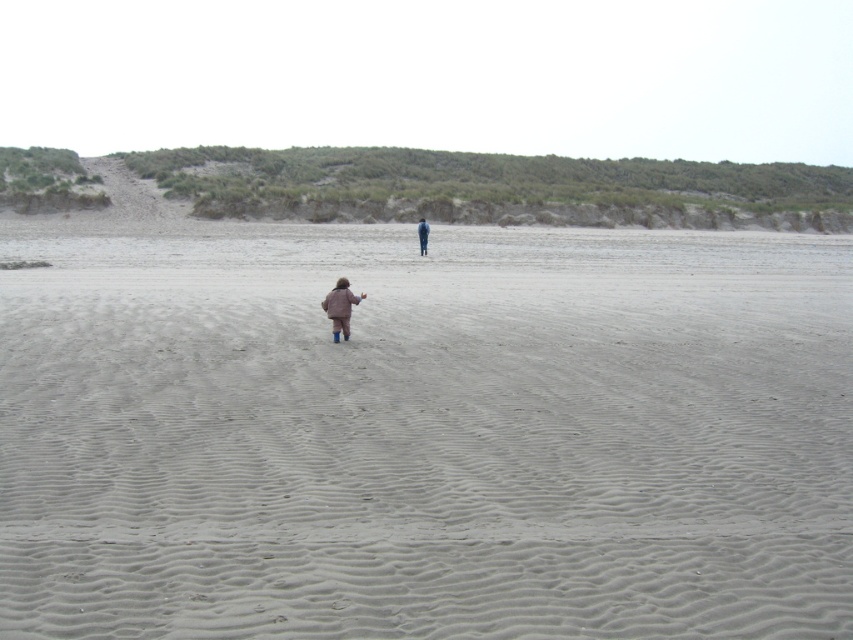
You are a photographer trying to capture the matte brown coat at lower center in the center of your photo frame. Given its current position at point coordinates, can you determine if it is already centered?

The matte brown coat at lower center is located at point coordinates, so it is already centered in the photo frame.

You are a photographer trying to capture both the matte brown coat at lower center and the denim jacket at center in a single frame. Based on their sizes, which one should you focus on first to ensure both are in focus?

The matte brown coat at lower center has a lesser height compared to the denim jacket at center, so you should focus on the denim jacket at center first to ensure both are in focus.